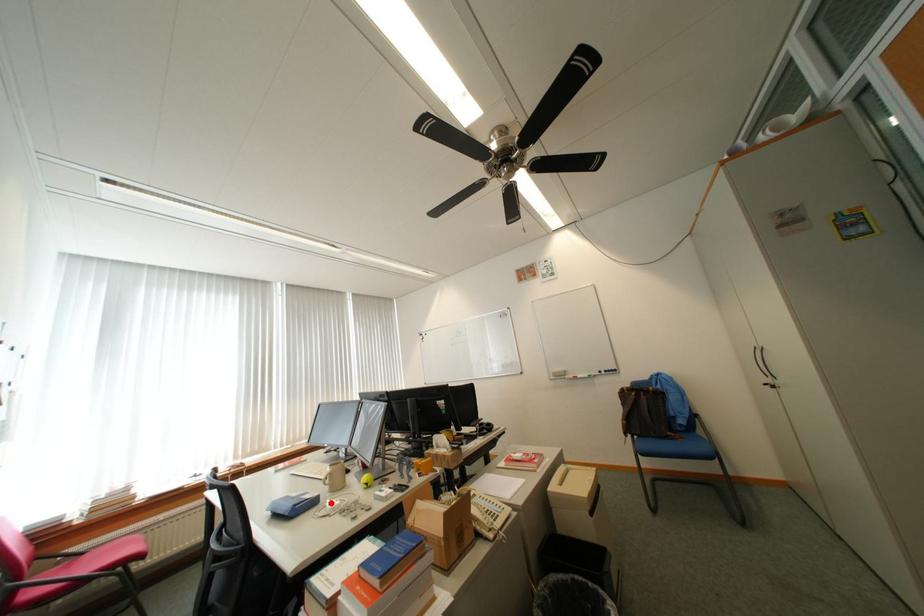
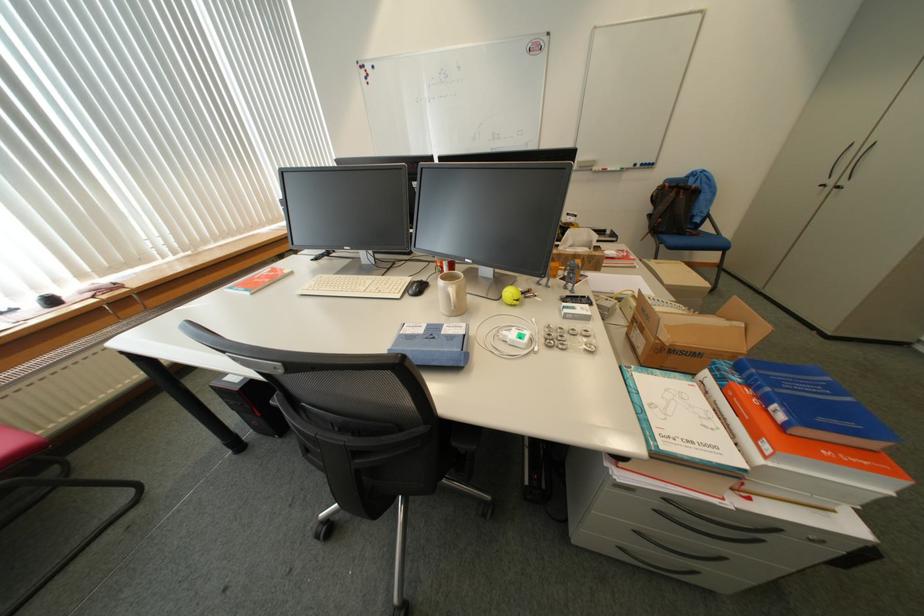
Where in the second image is the point corresponding to the highlighted location from the first image?

(481, 334)